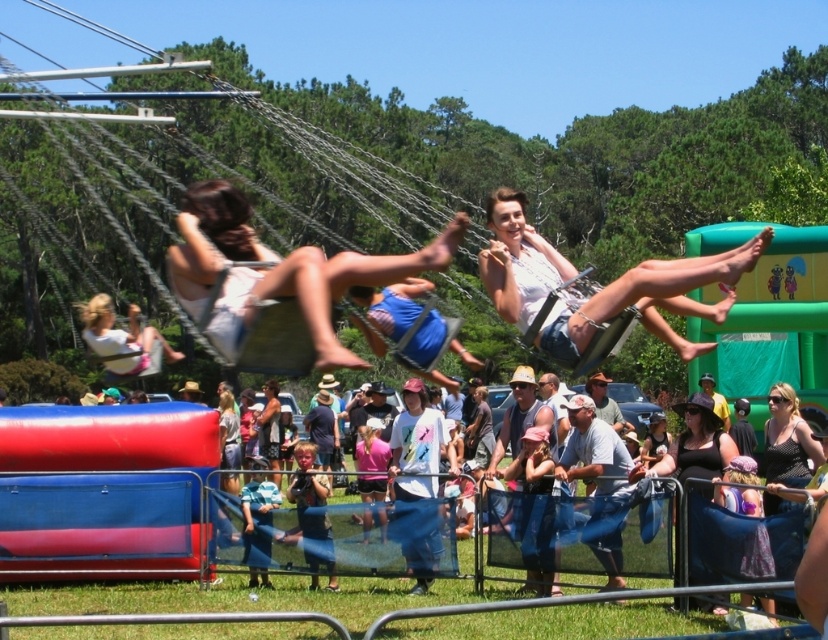
You are at the fair and want to take a photo of the white fabric dress at center and the matte black tank top at center. Which one should you focus on to ensure both are in the frame without moving the camera?

You should focus on the white fabric dress at center because it is closer to the viewer than the matte black tank top at center, so keeping it in focus will also include the matte black tank top at center in the background.

You are standing at the point marked at coordinate (708, 413) and want to walk to the swing ride. The swing ride is located at coordinate 0.453, 0.678. Given that the distance between these two points is 22.60 meters, can you estimate how far you need to walk to reach the swing ride?

The distance between the point marked at coordinate (708, 413) and the swing ride at coordinate 0.453, 0.678 is 22.60 meters, so you need to walk approximately 22.60 meters to reach the swing ride.

In the scene shown: You are at the fair and see two people wearing tank tops. One is wearing a matte black tank top at center and the other a black dotted tank top at lower right. Which person is standing higher up?

The black dotted tank top at lower right is higher up because the matte black tank top at center is located below it.